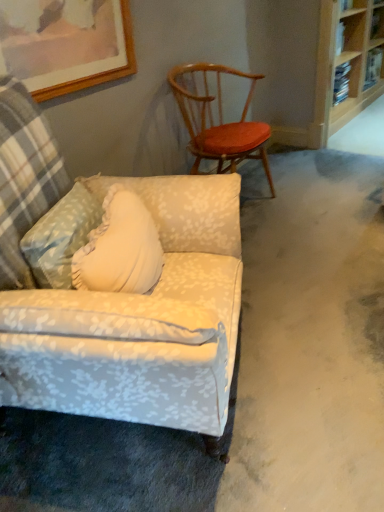
The height and width of the screenshot is (512, 384). In order to click on free spot in front of wooden spindles chair at upper right, which is counted as the 2th chair, starting from the front in this screenshot , I will do `click(271, 244)`.